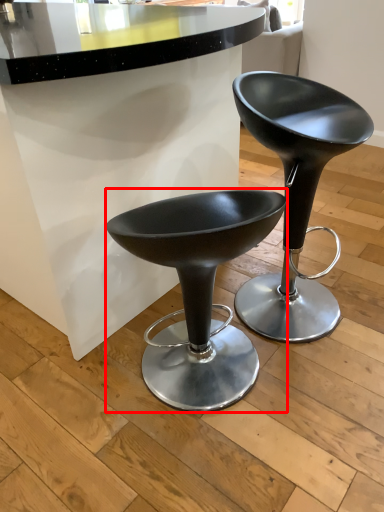
Question: Observing the image, what is the correct spatial positioning of stool (annotated by the red box) in reference to stool?

Choices:
 (A) left
 (B) right

Answer: (A)